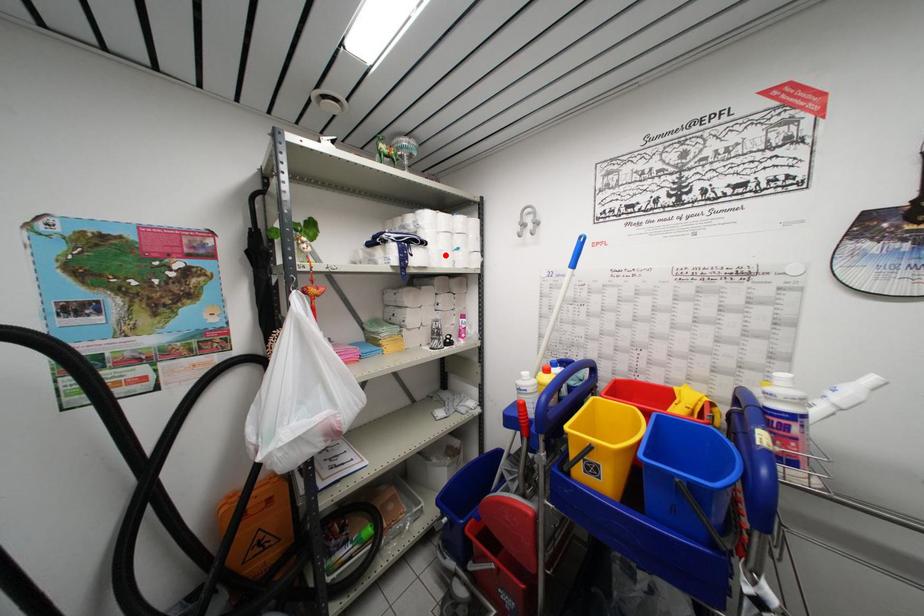
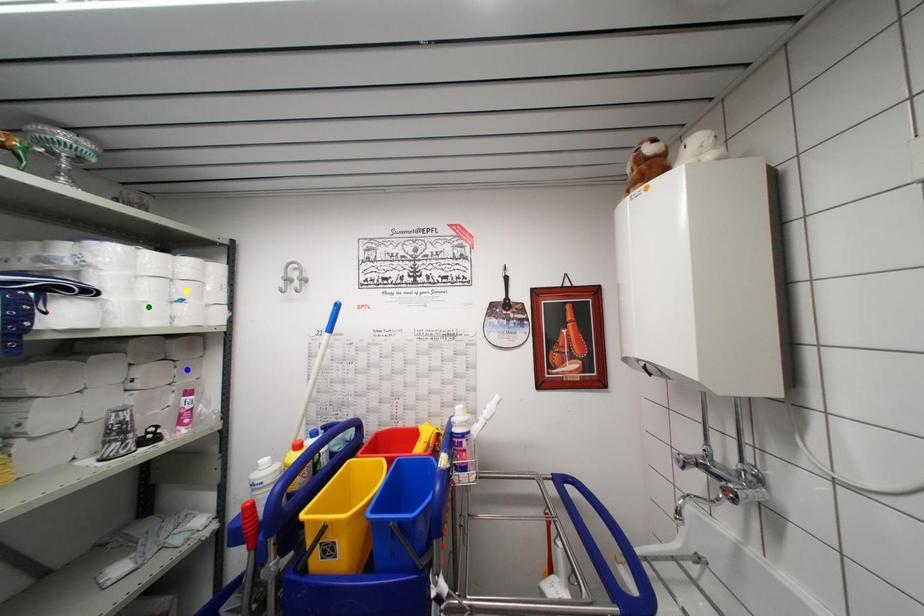
Question: I am providing you with two images of the same scene from different viewpoints. A red point is marked on the first image. You are given multiple points on the second image. Which point in image 2 represents the same 3d spot as the red point in image 1?

Choices:
 (A) green point
 (B) blue point
 (C) yellow point

Answer: (A)